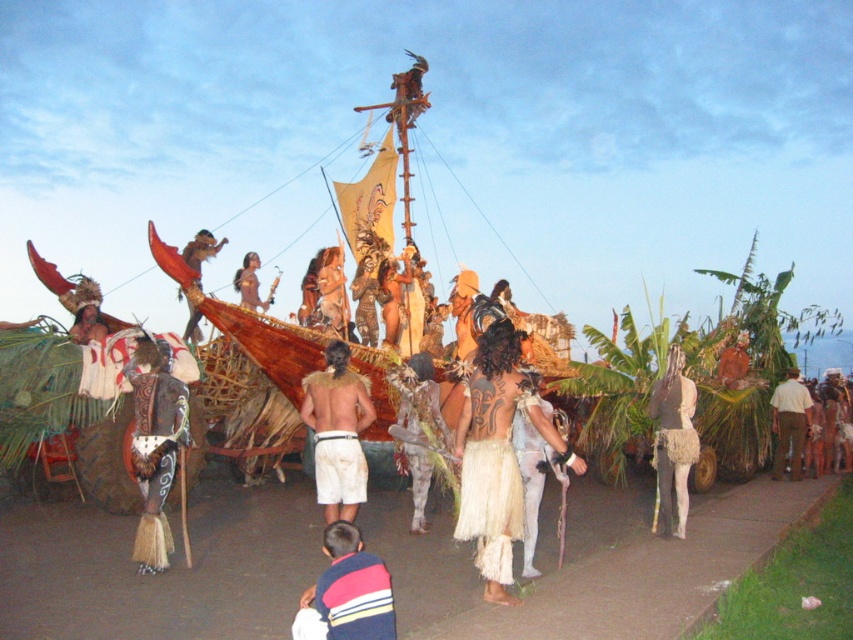
Question: Is white woven shorts at center positioned before brown textured pants at lower right?

Choices:
 (A) yes
 (B) no

Answer: (A)

Question: Is striped sweater at lower center behind brown textured pants at lower right?

Choices:
 (A) yes
 (B) no

Answer: (B)

Question: Which point is farther to the camera?

Choices:
 (A) white fringed skirt at center
 (B) white woven shorts at center
 (C) striped sweater at lower center
 (D) brown textured pants at lower right

Answer: (D)

Question: Which object is closer to the camera taking this photo?

Choices:
 (A) brown textured pants at lower right
 (B) white woven shorts at center
 (C) striped sweater at lower center

Answer: (C)

Question: Considering the relative positions of white fringed skirt at center and brown textured pants at lower right in the image provided, where is white fringed skirt at center located with respect to brown textured pants at lower right?

Choices:
 (A) right
 (B) left

Answer: (B)

Question: Which of the following is the farthest from the observer?

Choices:
 (A) striped sweater at lower center
 (B) brown textured pants at lower right
 (C) white fringed skirt at center

Answer: (B)